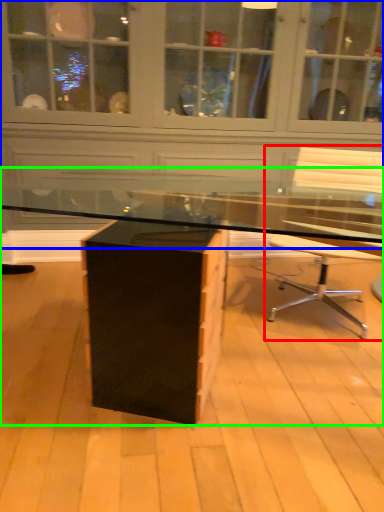
Question: Considering the real-world distances, which object is farthest from chair (highlighted by a red box)? dresser (highlighted by a blue box) or desk (highlighted by a green box)?

Choices:
 (A) dresser
 (B) desk

Answer: (A)